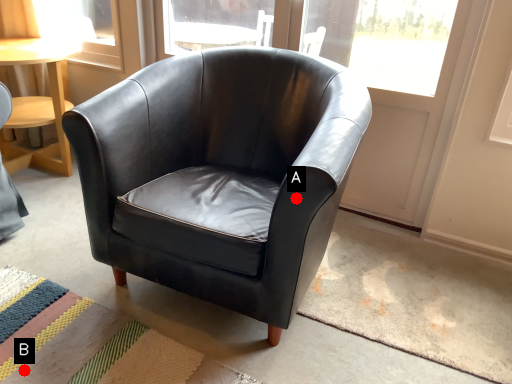
Question: Two points are circled on the image, labeled by A and B beside each circle. Which of the following is the farthest from the observer?

Choices:
 (A) A is further
 (B) B is further

Answer: (B)